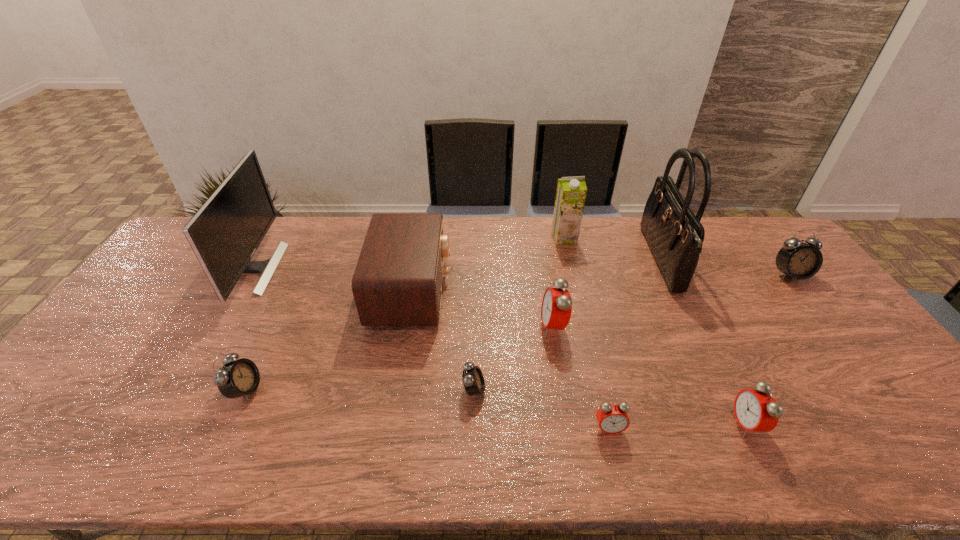
Where is `vacant position at the far edge of the desktop`? vacant position at the far edge of the desktop is located at coordinates (315, 233).

Identify the location of vacant region at the near edge of the desktop. Image resolution: width=960 pixels, height=540 pixels. (162, 461).

Find the location of a particular element. This screenshot has height=540, width=960. vacant area at the left edge of the desktop is located at coordinates 146,328.

You are a GUI agent. You are given a task and a screenshot of the screen. Output one action in this format:
    pyautogui.click(x=<x>, y=<y>)
    Task: Click on the vacant area at the right edge of the desktop
    
    Given the screenshot: What is the action you would take?
    pyautogui.click(x=831, y=339)

Find the location of a particular element. The height and width of the screenshot is (540, 960). vacant area at the far right corner of the desktop is located at coordinates (750, 233).

This screenshot has width=960, height=540. What are the coordinates of `vacant space that is in between the leftmost alarm clock and the rightmost red alarm clock` in the screenshot? It's located at (496, 407).

Find the location of a particular element. Image resolution: width=960 pixels, height=540 pixels. vacant space that is in between the second smallest white alarm clock and the eighth object from right to left is located at coordinates (328, 340).

In order to click on unoccupied position between the third alarm clock from right to left and the rightmost object in this screenshot , I will do `click(700, 352)`.

I want to click on vacant space that's between the third tallest object and the third alarm clock from right to left, so click(x=587, y=333).

The width and height of the screenshot is (960, 540). In order to click on empty location between the handbag and the rightmost red alarm clock in this screenshot , I will do `click(704, 342)`.